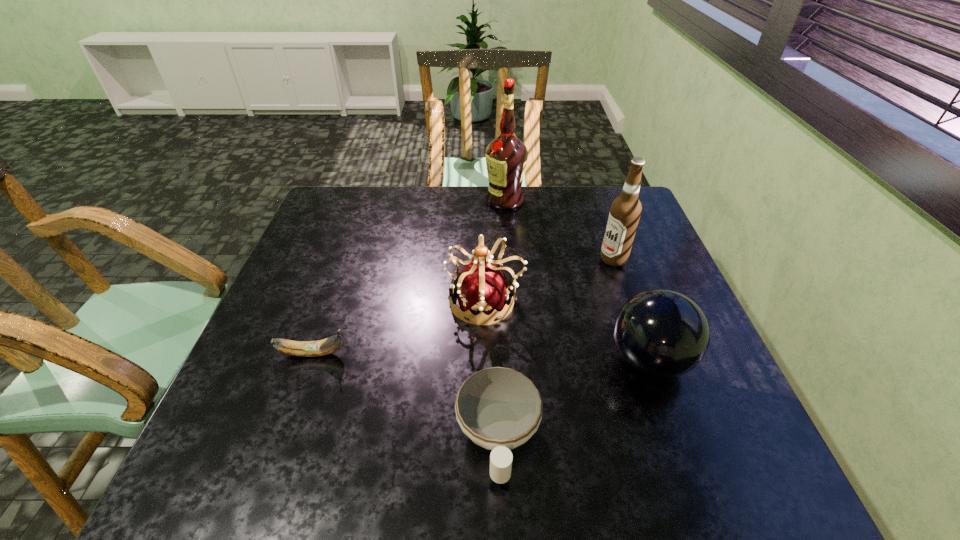
At what (x,y) coordinates should I click in order to perform the action: click on vacant space positioned 0.100m on the peel of the banana. Please return your answer as a coordinate pair (x, y). This screenshot has height=540, width=960. Looking at the image, I should click on (394, 354).

Locate an element on the screen. This screenshot has width=960, height=540. object located in the far edge section of the desktop is located at coordinates (506, 156).

At what (x,y) coordinates should I click in order to perform the action: click on object located in the near edge section of the desktop. Please return your answer as a coordinate pair (x, y). The width and height of the screenshot is (960, 540). Looking at the image, I should click on (499, 409).

You are a GUI agent. You are given a task and a screenshot of the screen. Output one action in this format:
    pyautogui.click(x=<x>, y=<y>)
    Task: Click on the object that is at the left edge
    The height and width of the screenshot is (540, 960).
    Given the screenshot: What is the action you would take?
    pyautogui.click(x=329, y=345)

Where is `alcohol that is at the right edge`? This screenshot has height=540, width=960. alcohol that is at the right edge is located at coordinates (625, 211).

Locate an element on the screen. The image size is (960, 540). bowling ball that is at the right edge is located at coordinates (661, 333).

Locate an element on the screen. vacant region at the far edge of the desktop is located at coordinates (497, 220).

Locate an element on the screen. vacant space at the left edge of the desktop is located at coordinates (359, 232).

Find the location of a particular element. The width and height of the screenshot is (960, 540). vacant space at the right edge is located at coordinates (646, 231).

The width and height of the screenshot is (960, 540). Find the location of `free space at the far left corner of the desktop`. free space at the far left corner of the desktop is located at coordinates (368, 202).